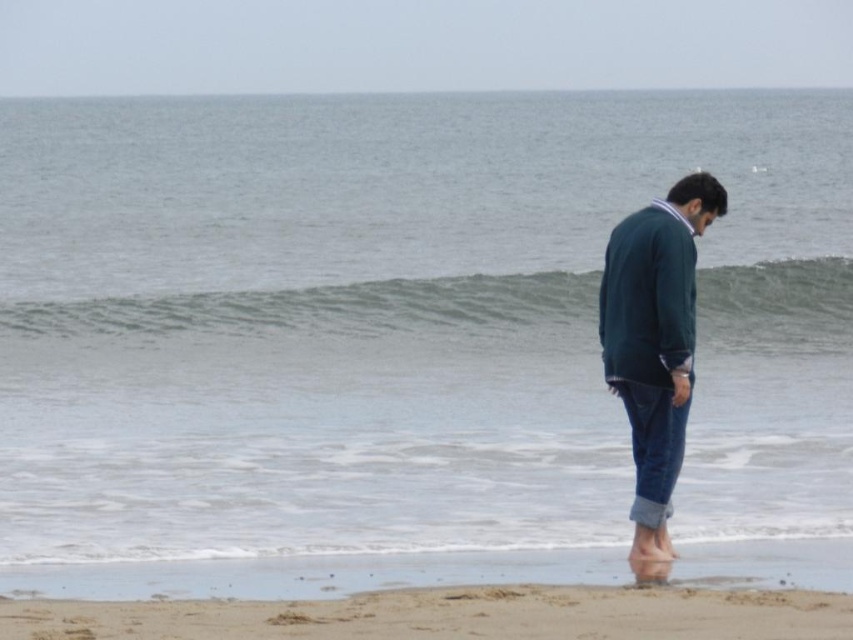
Question: Is smooth beige sand at lower center to the left of dark green sweater at center from the viewer's perspective?

Choices:
 (A) no
 (B) yes

Answer: (B)

Question: Which object is the closest to the smooth beige sand at lower center?

Choices:
 (A) dark green sweater at center
 (B) green textured wave at center

Answer: (A)

Question: Estimate the real-world distances between objects in this image. Which object is farther from the green textured wave at center?

Choices:
 (A) dark green sweater at center
 (B) smooth beige sand at lower center

Answer: (B)

Question: Is green textured wave at center thinner than smooth beige sand at lower center?

Choices:
 (A) no
 (B) yes

Answer: (A)

Question: From the image, what is the correct spatial relationship of green textured wave at center in relation to dark green sweater at center?

Choices:
 (A) left
 (B) right

Answer: (A)

Question: Considering the real-world distances, which object is closest to the smooth beige sand at lower center?

Choices:
 (A) dark green sweater at center
 (B) green textured wave at center

Answer: (A)